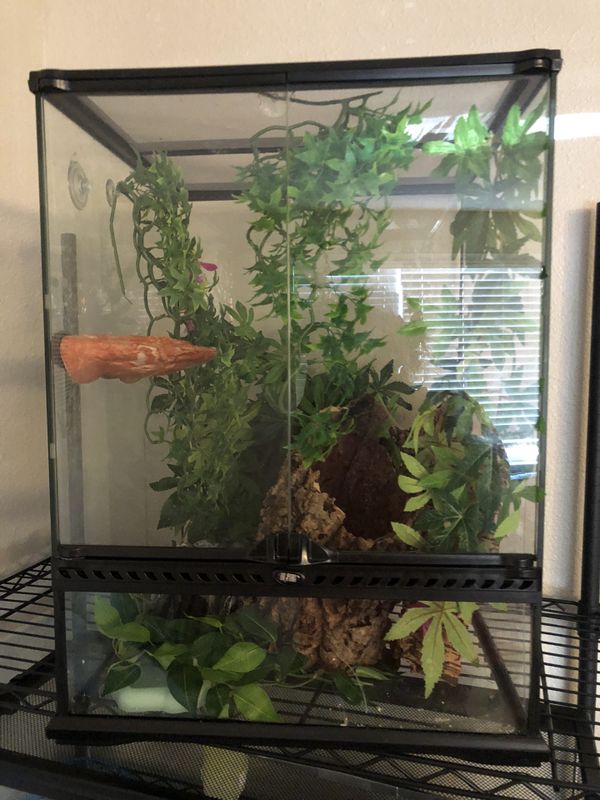
I want to click on light from the window, so pos(585,122).